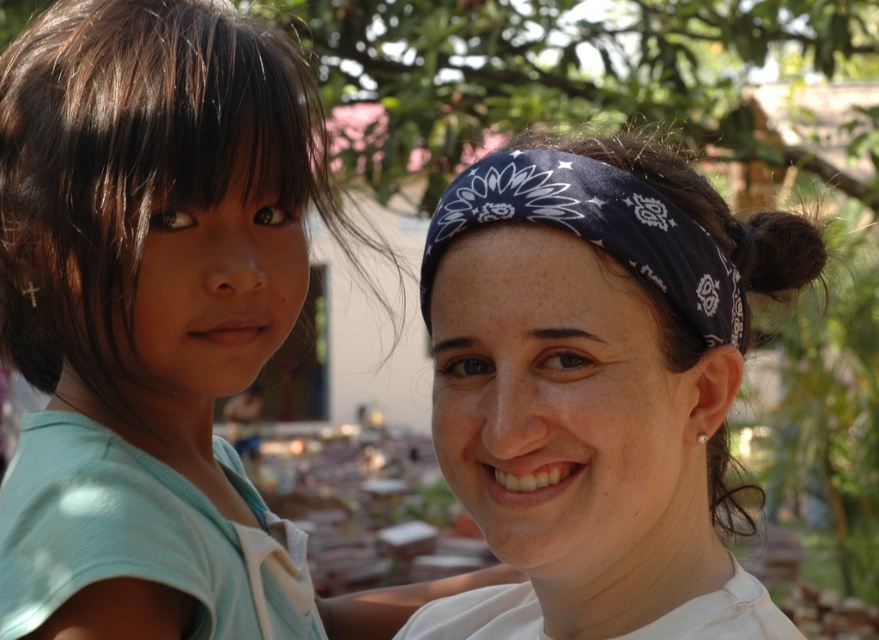
Is light blue fabric shirt at left further to the viewer compared to dark blue bandana at center?

No, it is in front of dark blue bandana at center.

Is light blue fabric shirt at left shorter than dark blue bandana at center?

No, light blue fabric shirt at left is not shorter than dark blue bandana at center.

This screenshot has width=879, height=640. In order to click on light blue fabric shirt at left in this screenshot , I will do `click(163, 298)`.

Who is lower down, light blue fabric shirt at left or white cotton headband at upper right?

white cotton headband at upper right

Between point (216, 380) and point (601, 419), which one is positioned behind?

Point (216, 380)

What do you see at coordinates (163, 298) in the screenshot?
I see `light blue fabric shirt at left` at bounding box center [163, 298].

Where is `light blue fabric shirt at left`? This screenshot has height=640, width=879. light blue fabric shirt at left is located at coordinates coord(163,298).

Does white cotton headband at upper right lie in front of dark blue bandana at center?

Yes, it is.

Does white cotton headband at upper right have a larger size compared to dark blue bandana at center?

Correct, white cotton headband at upper right is larger in size than dark blue bandana at center.

Does point (456, 612) come farther from viewer compared to point (742, 336)?

Yes.

Find the location of a particular element. white cotton headband at upper right is located at coordinates (597, 388).